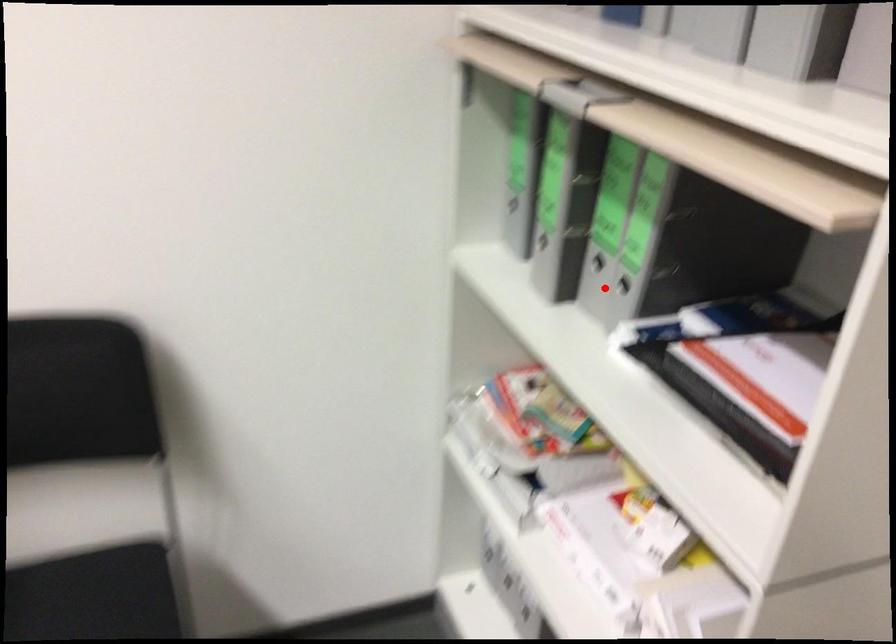
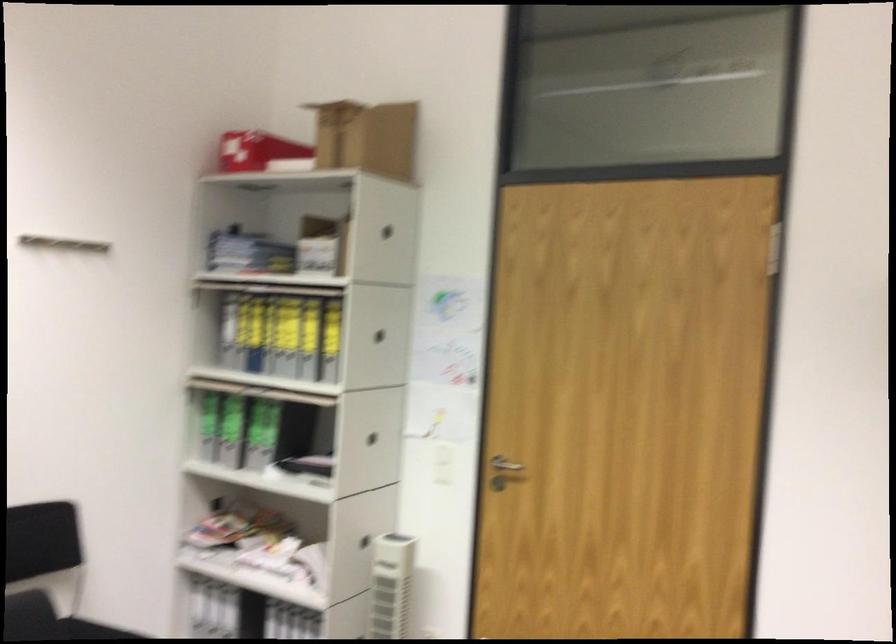
Question: I am providing you with two images of the same scene from different viewpoints. A red point is marked on the first image. At the location where the point appears in image 1, is it still visible in image 2?

Choices:
 (A) Yes
 (B) No

Answer: (A)